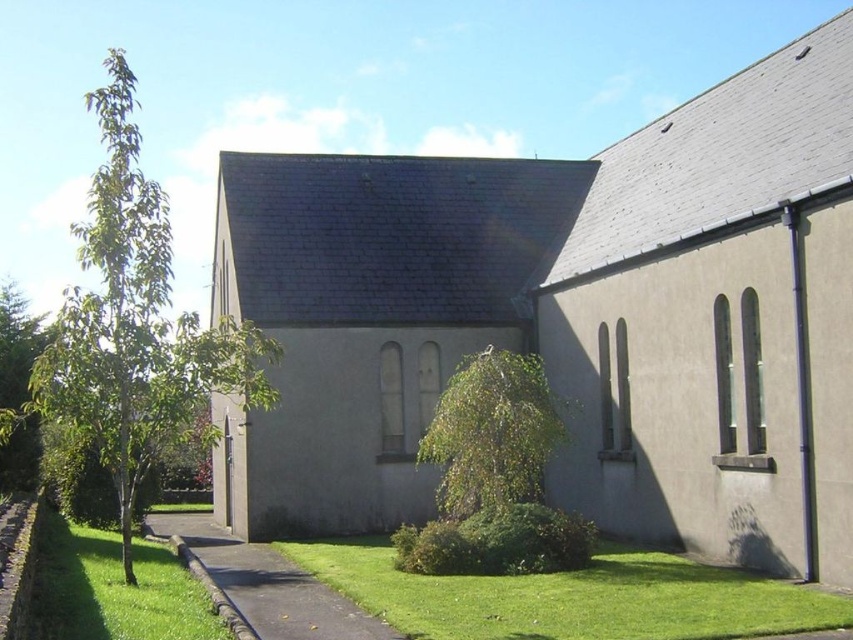
Question: Which object is closer to the camera taking this photo?

Choices:
 (A) smooth beige church at center
 (B) green leafy bush at center

Answer: (A)

Question: Among these objects, which one is farthest from the camera?

Choices:
 (A) green leafy tree at center
 (B) green grass at lower left

Answer: (A)

Question: Does green leafy tree at left appear over green grass at lower center?

Choices:
 (A) yes
 (B) no

Answer: (A)

Question: Can you confirm if green grass at lower center is bigger than green leafy bush at center?

Choices:
 (A) yes
 (B) no

Answer: (A)

Question: Does green grass at lower center appear on the left side of green leafy bush at center?

Choices:
 (A) yes
 (B) no

Answer: (B)

Question: Estimate the real-world distances between objects in this image. Which object is closer to the green leafy tree at left?

Choices:
 (A) smooth beige church at center
 (B) green leafy tree at center

Answer: (A)